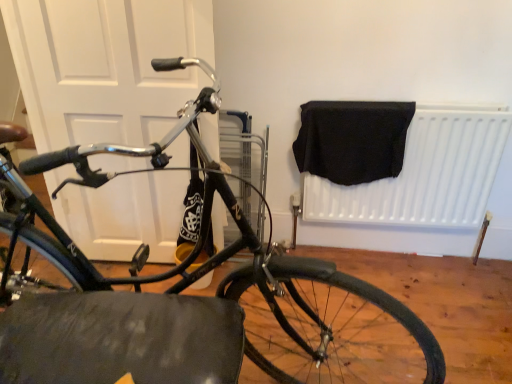
The image size is (512, 384). What do you see at coordinates (352, 140) in the screenshot?
I see `black fabric at upper right` at bounding box center [352, 140].

What are the coordinates of `shiny black bicycle at center` in the screenshot? It's located at (188, 297).

What do you see at coordinates (424, 174) in the screenshot? The height and width of the screenshot is (384, 512). I see `white matte radiator at upper right` at bounding box center [424, 174].

What do you see at coordinates (105, 66) in the screenshot? Image resolution: width=512 pixels, height=384 pixels. I see `white matte door at left` at bounding box center [105, 66].

The image size is (512, 384). I want to click on black fabric at upper right, so click(x=352, y=140).

From the image's perspective, which is below, white matte door at left or white matte radiator at upper right?

From the image's view, white matte radiator at upper right is below.

Considering the sizes of objects white matte door at left and white matte radiator at upper right in the image provided, who is bigger, white matte door at left or white matte radiator at upper right?

Bigger between the two is white matte door at left.

Is white matte door at left far away from white matte radiator at upper right?

They are positioned close to each other.

Which object is further away from the camera taking this photo, white matte door at left or white matte radiator at upper right?

Positioned behind is white matte radiator at upper right.

Is white matte door at left bigger than black rubber tire at lower center?

Yes, white matte door at left is bigger than black rubber tire at lower center.

In the image, there is a white matte door at left. Identify the location of bicycle wheel below it (from a real-world perspective). (330, 328).

Is there a large distance between white matte door at left and black rubber tire at lower center?

No, there isn't a large distance between white matte door at left and black rubber tire at lower center.

Is shiny black bicycle at center smaller than black fabric at upper right?

Incorrect, shiny black bicycle at center is not smaller in size than black fabric at upper right.

At what (x,y) coordinates should I click in order to perform the action: click on bicycle in front of the black fabric at upper right. Please return your answer as a coordinate pair (x, y). The height and width of the screenshot is (384, 512). Looking at the image, I should click on (188, 297).

Is the depth of shiny black bicycle at center less than that of black fabric at upper right?

Yes, shiny black bicycle at center is in front of black fabric at upper right.

From the image's perspective, which is below, shiny black bicycle at center or black fabric at upper right?

shiny black bicycle at center is shown below in the image.

Can you confirm if white matte door at left is positioned to the left of shiny black bicycle at center?

Indeed, white matte door at left is positioned on the left side of shiny black bicycle at center.

Is white matte door at left thinner than shiny black bicycle at center?

Indeed, white matte door at left has a lesser width compared to shiny black bicycle at center.

Which is nearer, (174, 47) or (23, 338)?

The point (23, 338) is more forward.

Which of these two, shiny black bicycle at center or white matte radiator at upper right, is bigger?

Bigger between the two is shiny black bicycle at center.

Is the depth of shiny black bicycle at center greater than that of white matte radiator at upper right?

No, the depth of shiny black bicycle at center is less than that of white matte radiator at upper right.

From the image's perspective, would you say shiny black bicycle at center is positioned over white matte radiator at upper right?

Incorrect, from the image's perspective, shiny black bicycle at center is lower than white matte radiator at upper right.

Would you say shiny black bicycle at center is to the left or to the right of white matte radiator at upper right in the picture?

Based on their positions, shiny black bicycle at center is located to the left of white matte radiator at upper right.

From a real-world perspective, is black rubber tire at lower center above or below black fabric at upper right?

Clearly, from a real-world perspective, black rubber tire at lower center is below black fabric at upper right.

Is black fabric at upper right inside black rubber tire at lower center?

No, black fabric at upper right is not a part of black rubber tire at lower center.

Which object is more forward, black rubber tire at lower center or black fabric at upper right?

black rubber tire at lower center.

Is black rubber tire at lower center wider or thinner than black fabric at upper right?

In the image, black rubber tire at lower center appears to be wider than black fabric at upper right.

Is white matte radiator at upper right closer to the viewer compared to white matte door at left?

No, white matte radiator at upper right is further to the viewer.

Between white matte radiator at upper right and white matte door at left, which one has smaller width?

Thinner between the two is white matte door at left.

Is white matte radiator at upper right turned away from white matte door at left?

white matte radiator at upper right does not have its back to white matte door at left.

At what (x,y) coordinates should I click in order to perform the action: click on door above the white matte radiator at upper right (from the image's perspective). Please return your answer as a coordinate pair (x, y). The height and width of the screenshot is (384, 512). Looking at the image, I should click on (105, 66).

Identify the location of bicycle wheel located below the white matte door at left (from the image's perspective). (330, 328).

When comparing their distances from white matte door at left, does shiny black bicycle at center or white matte radiator at upper right seem closer?

The object closer to white matte door at left is shiny black bicycle at center.

Considering their positions, is black rubber tire at lower center positioned closer to white matte radiator at upper right than white matte door at left?

Based on the image, black rubber tire at lower center appears to be nearer to white matte radiator at upper right.

From the image, which object appears to be nearer to black fabric at upper right, white matte door at left or white matte radiator at upper right?

Based on the image, white matte radiator at upper right appears to be nearer to black fabric at upper right.

From the image, which object appears to be nearer to white matte radiator at upper right, black fabric at upper right or black rubber tire at lower center?

Based on the image, black fabric at upper right appears to be nearer to white matte radiator at upper right.

When comparing their distances from white matte door at left, does black rubber tire at lower center or shiny black bicycle at center seem closer?

Based on the image, shiny black bicycle at center appears to be nearer to white matte door at left.

Based on their spatial positions, is black rubber tire at lower center or black fabric at upper right closer to shiny black bicycle at center?

black rubber tire at lower center is closer to shiny black bicycle at center.

Based on their spatial positions, is white matte door at left or shiny black bicycle at center further from black rubber tire at lower center?

white matte door at left is positioned further to the anchor black rubber tire at lower center.

Which object lies nearer to the anchor point white matte radiator at upper right, black rubber tire at lower center or shiny black bicycle at center?

Among the two, black rubber tire at lower center is located nearer to white matte radiator at upper right.

I want to click on bicycle between white matte door at left and black rubber tire at lower center, so click(x=188, y=297).

Where is `bicycle wheel between shiny black bicycle at center and white matte radiator at upper right in the front-back direction`? The width and height of the screenshot is (512, 384). bicycle wheel between shiny black bicycle at center and white matte radiator at upper right in the front-back direction is located at coordinates (330, 328).

Find the location of a particular element. The width and height of the screenshot is (512, 384). bicycle wheel between white matte door at left and white matte radiator at upper right is located at coordinates (330, 328).

Locate an element on the screen. The height and width of the screenshot is (384, 512). blanket between shiny black bicycle at center and white matte radiator at upper right along the z-axis is located at coordinates (352, 140).